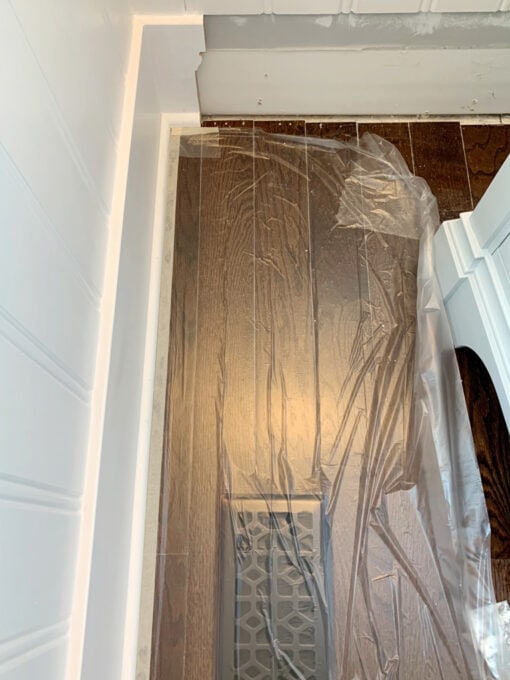
You are a GUI agent. You are given a task and a screenshot of the screen. Output one action in this format:
    pyautogui.click(x=<x>, y=<y>)
    Task: Click on the light grey paint
    This screenshot has height=680, width=510.
    Given the screenshot: What is the action you would take?
    pyautogui.click(x=267, y=32)